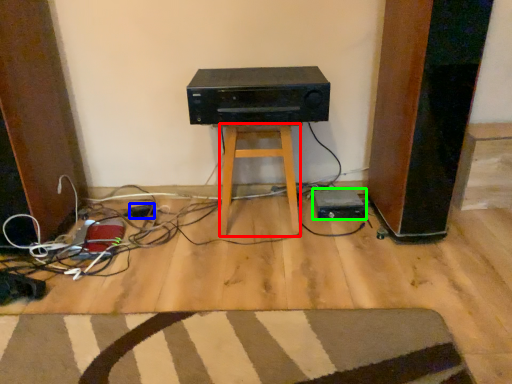
Question: Which object is the closest to the stool (highlighted by a red box)? Choose among these: plug (highlighted by a blue box) or appliance (highlighted by a green box).

Choices:
 (A) plug
 (B) appliance

Answer: (B)